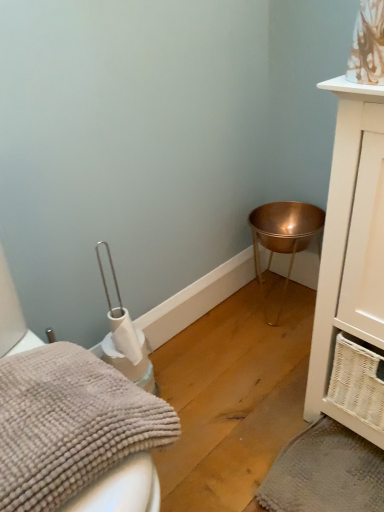
The width and height of the screenshot is (384, 512). In order to click on empty space that is ontop of gray fluffy bath towel at lower left, which is the second bath towel in back-to-front order in this screenshot , I will do [35, 426].